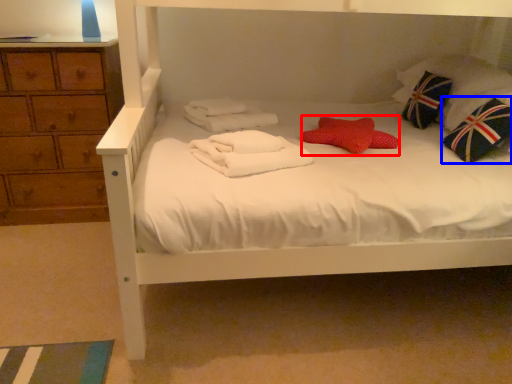
Question: Which object appears closest to the camera in this image, pillow (highlighted by a red box) or throw pillow (highlighted by a blue box)?

Choices:
 (A) pillow
 (B) throw pillow

Answer: (B)